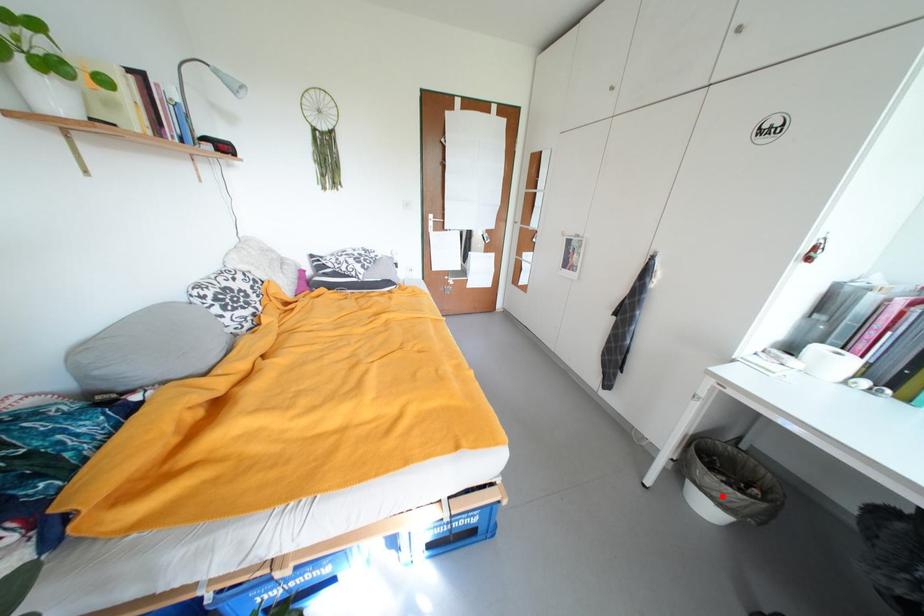
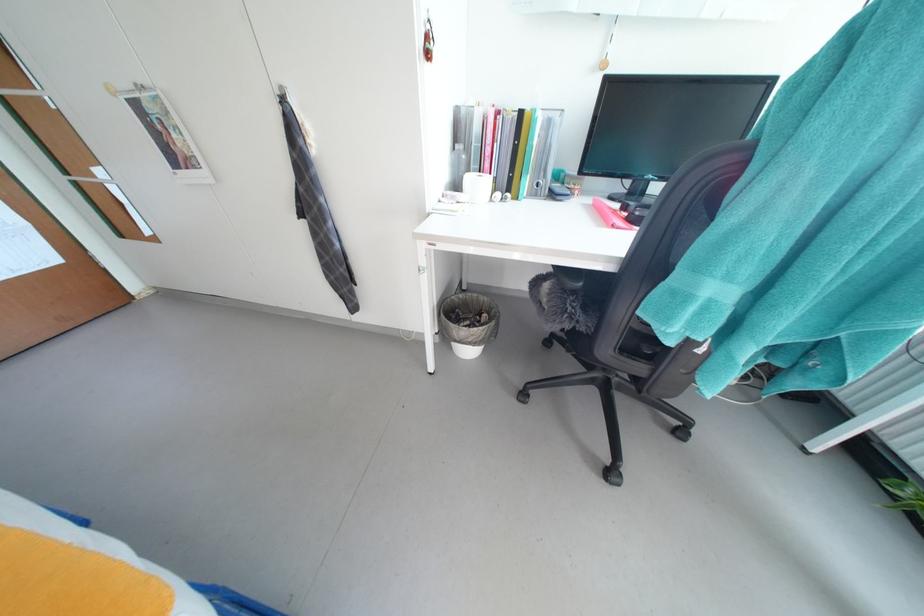
The point at the highlighted location is marked in the first image. Where is the corresponding point in the second image?

(478, 342)